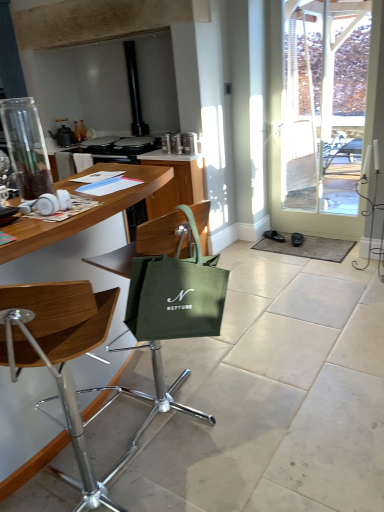
At what (x,y) coordinates should I click in order to perform the action: click on vacant area located to the right-hand side of green fabric bag at center, which appears as the 2th chair when viewed from the front. Please return your answer as a coordinate pair (x, y). This screenshot has height=512, width=384. Looking at the image, I should click on (255, 402).